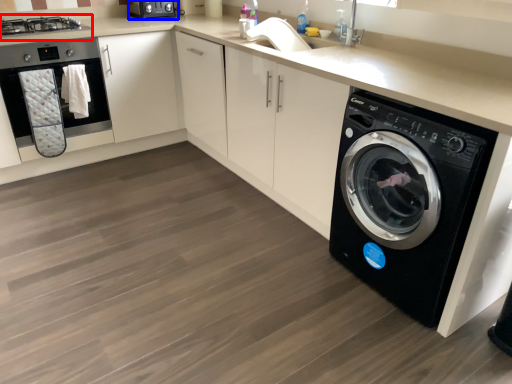
Question: Which object appears closest to the camera in this image, stove (highlighted by a red box) or appliance (highlighted by a blue box)?

Choices:
 (A) stove
 (B) appliance

Answer: (A)